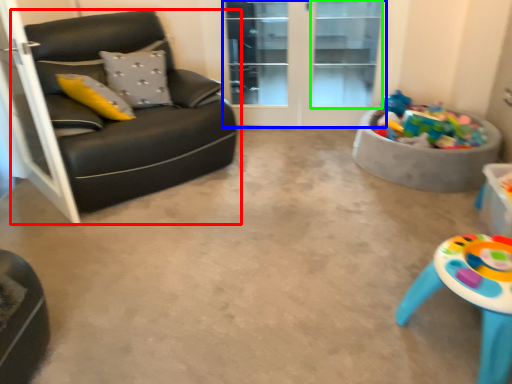
Question: Based on their relative distances, which object is farther from studio couch (highlighted by a red box)? Choose from glass door (highlighted by a blue box) and window (highlighted by a green box).

Choices:
 (A) glass door
 (B) window

Answer: (B)